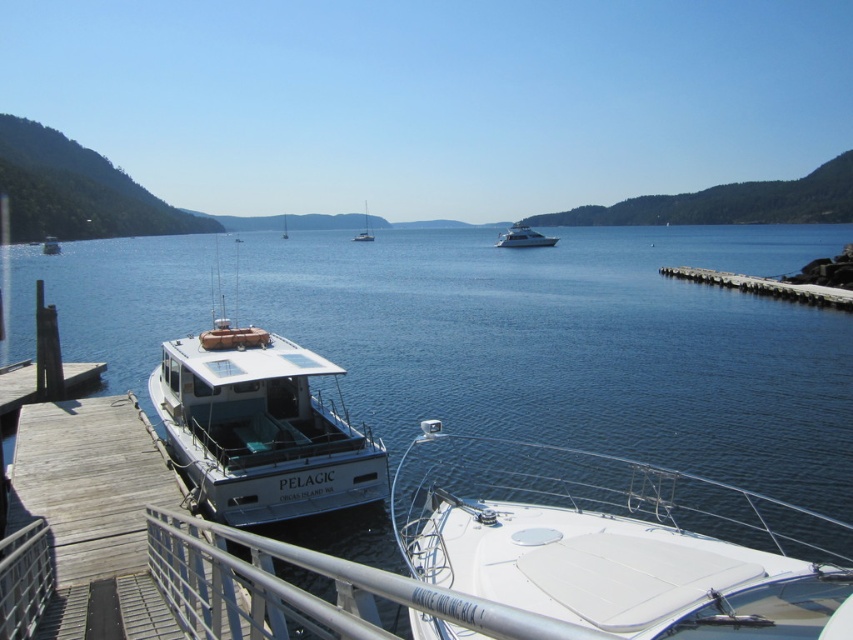
Who is positioned more to the left, white matte boat at lower left or white matte sailboat at center?

white matte sailboat at center is more to the left.

Looking at this image, which of these two, white matte boat at lower left or white matte sailboat at center, stands taller?

white matte sailboat at center

Does point (158, 381) come behind point (360, 241)?

No.

Locate an element on the screen. This screenshot has height=640, width=853. white matte boat at lower left is located at coordinates (259, 428).

Who is lower down, white matte boat at lower left or white matte boat at left?

white matte boat at lower left is lower down.

Is white matte boat at lower left taller than white matte boat at left?

Incorrect, white matte boat at lower left's height is not larger of white matte boat at left's.

Is point (271, 442) positioned before point (47, 244)?

Yes, point (271, 442) is in front of point (47, 244).

You are a GUI agent. You are given a task and a screenshot of the screen. Output one action in this format:
    pyautogui.click(x=<x>, y=<y>)
    Task: Click on the white matte boat at lower left
    
    Given the screenshot: What is the action you would take?
    pyautogui.click(x=259, y=428)

Is white glossy boat at center above white matte boat at lower left?

Incorrect, white glossy boat at center is not positioned above white matte boat at lower left.

Between point (654, 544) and point (253, 476), which one is positioned in front?

Point (654, 544) is more forward.

Locate an element on the screen. This screenshot has width=853, height=640. white glossy boat at center is located at coordinates (614, 541).

Where is `white glossy boat at center`? Image resolution: width=853 pixels, height=640 pixels. white glossy boat at center is located at coordinates 614,541.